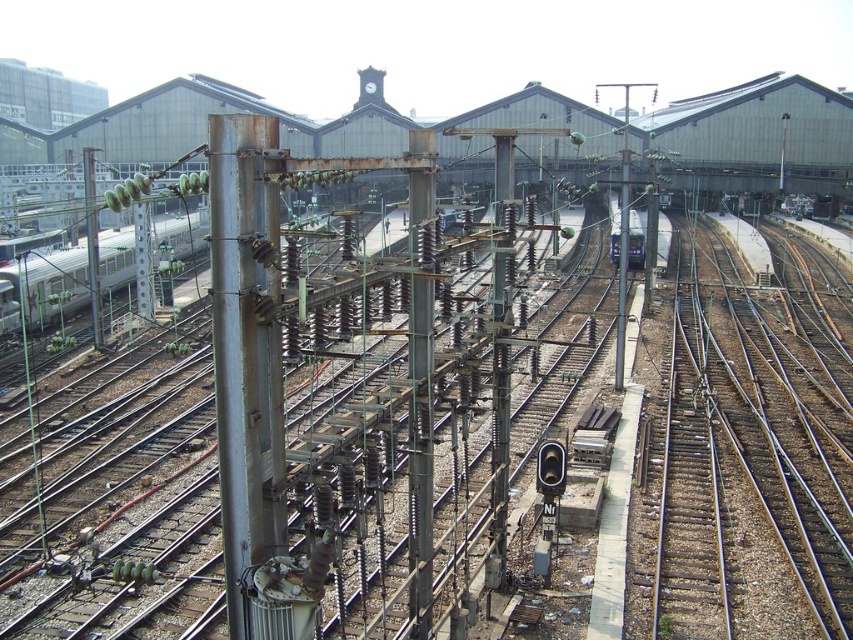
You are a train conductor preparing to move the silver metallic train at left. You notice the brown gravel train track at right in your line of sight. Is the track closer to you than the train?

The brown gravel train track at right is in front of the silver metallic train at left, meaning it is closer to you than the train.

You are standing in the railway yard and want to determine the relative positions of two points marked in the scene. Which point is closer to you, point 1 at coordinates (65, 282) or point 2 at coordinates (619, 234)?

Point 1 at coordinates (65, 282) is closer to you than point 2 at coordinates (619, 234).